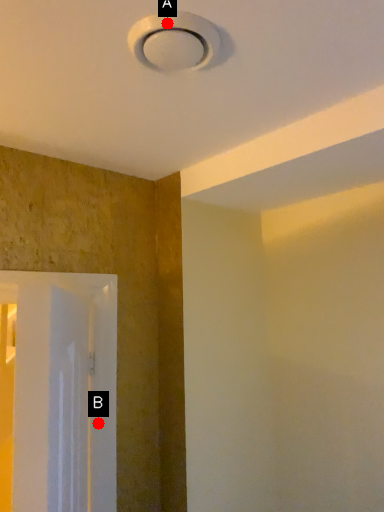
Question: Two points are circled on the image, labeled by A and B beside each circle. Which point is farther from the camera taking this photo?

Choices:
 (A) A is further
 (B) B is further

Answer: (B)